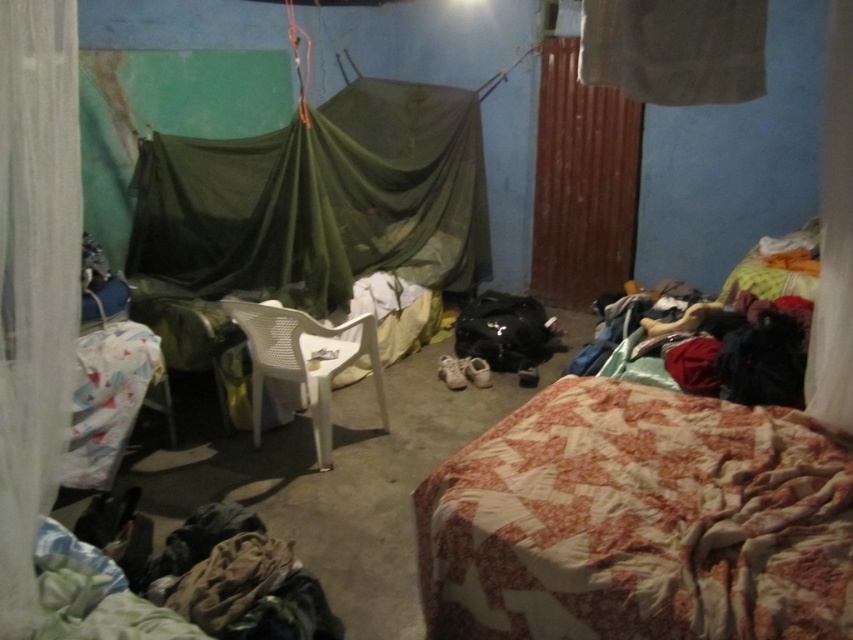
Question: Can you confirm if patchwork quilted bed at lower right is smaller than green netting canopy at center?

Choices:
 (A) no
 (B) yes

Answer: (B)

Question: Is white sheer curtain at left above white sheer curtain at upper center?

Choices:
 (A) yes
 (B) no

Answer: (B)

Question: Which of the following is the closest to the observer?

Choices:
 (A) click(x=267, y=257)
 (B) click(x=254, y=371)

Answer: (B)

Question: Among these objects, which one is farthest from the camera?

Choices:
 (A) white sheer curtain at right
 (B) white sheer curtain at upper center
 (C) green netting canopy at center

Answer: (C)

Question: Is white sheer curtain at left to the right of white plastic chair at center from the viewer's perspective?

Choices:
 (A) yes
 (B) no

Answer: (B)

Question: Which object is the closest to the white sheer curtain at right?

Choices:
 (A) patchwork quilted bed at lower right
 (B) white sheer curtain at left
 (C) white plastic chair at center

Answer: (A)